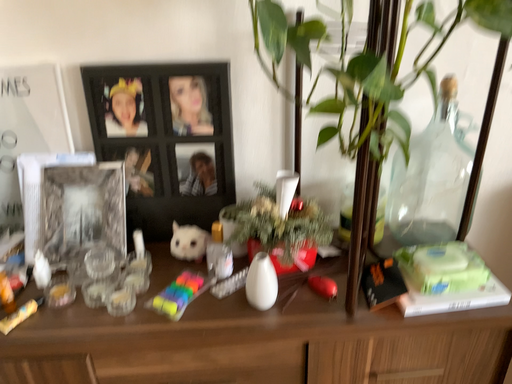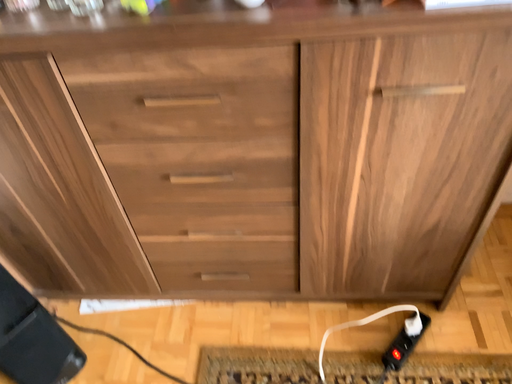
Question: Which way did the camera rotate in the video?

Choices:
 (A) rotated downward
 (B) rotated upward

Answer: (A)